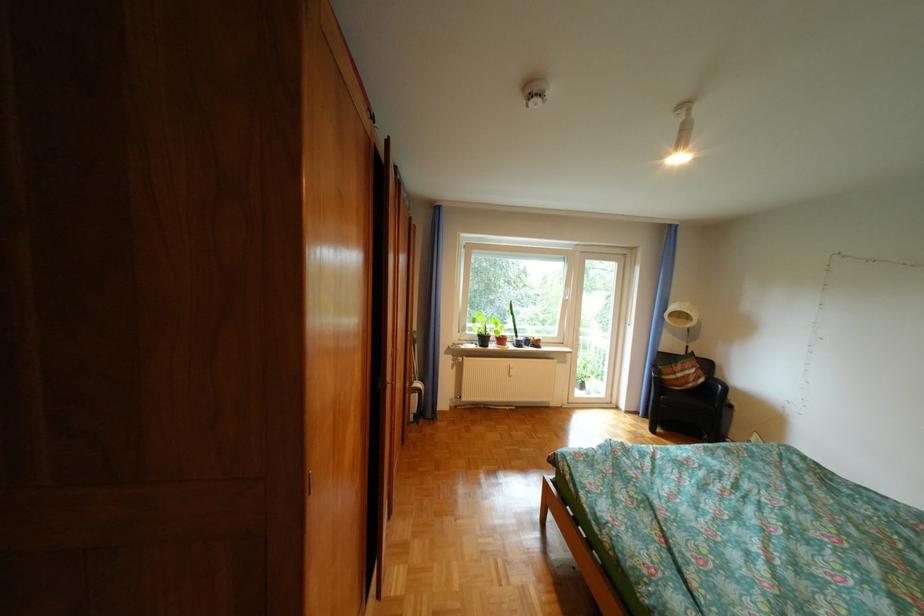
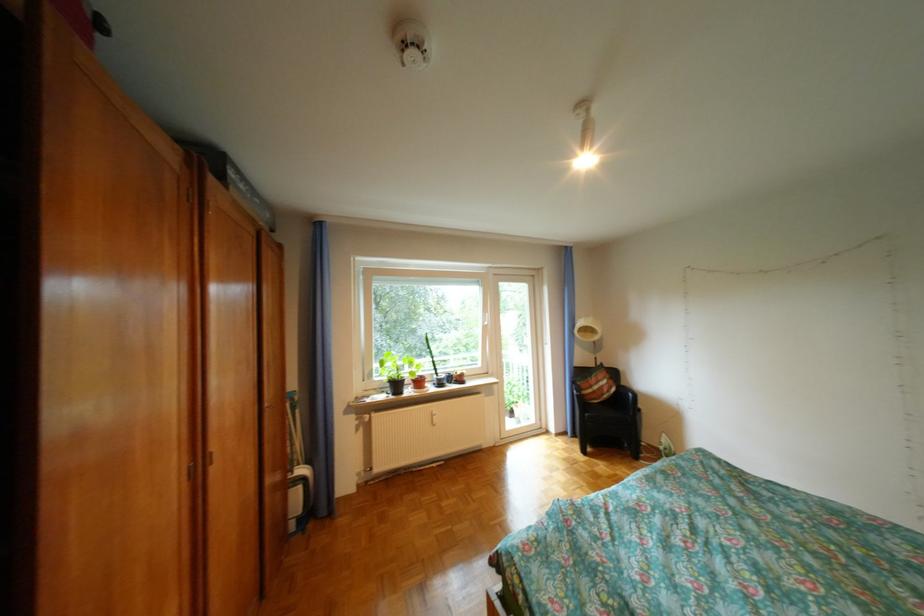
Find the pixel in the second image that matches the point at 432,385 in the first image.

(317, 471)